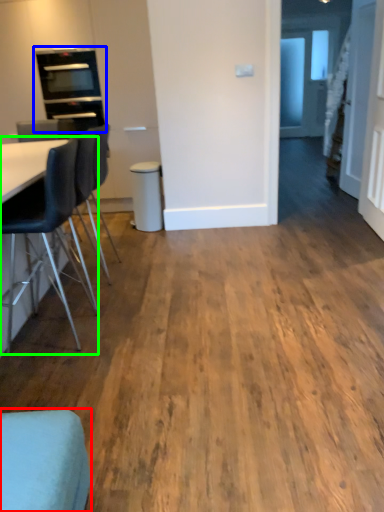
Question: Which is nearer to the chair (highlighted by a red box)? appliance (highlighted by a blue box) or chair (highlighted by a green box).

Choices:
 (A) appliance
 (B) chair

Answer: (B)